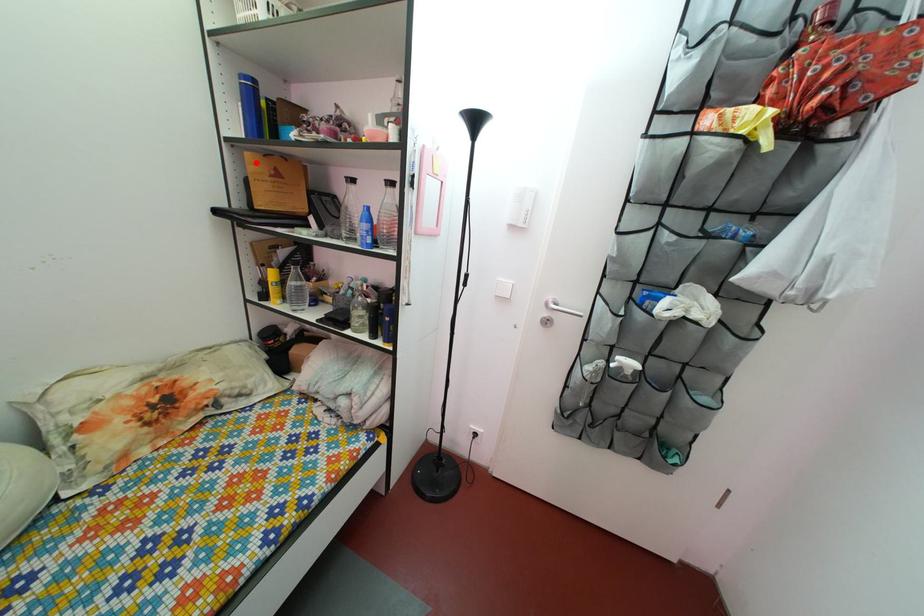
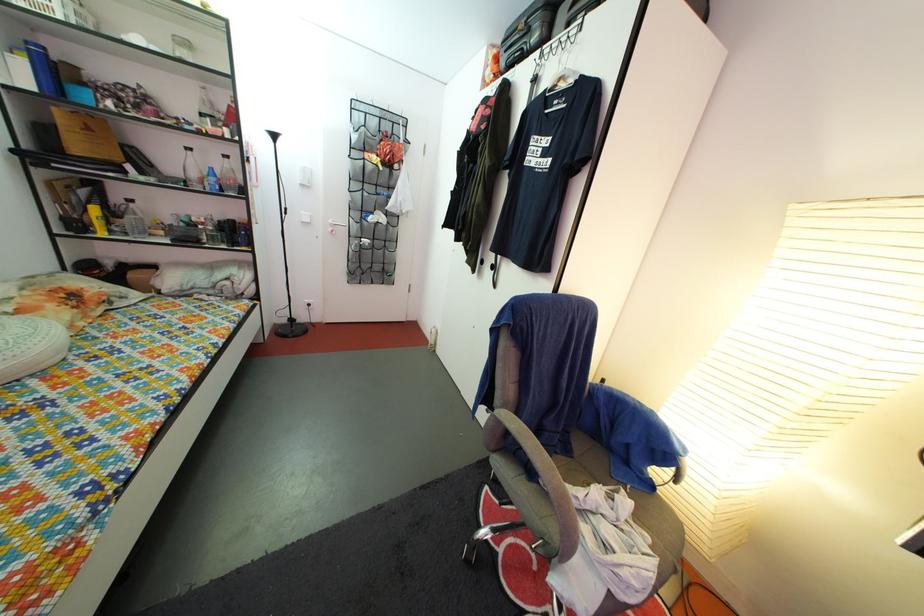
The point at the highlighted location is marked in the first image. Where is the corresponding point in the second image?

(64, 118)